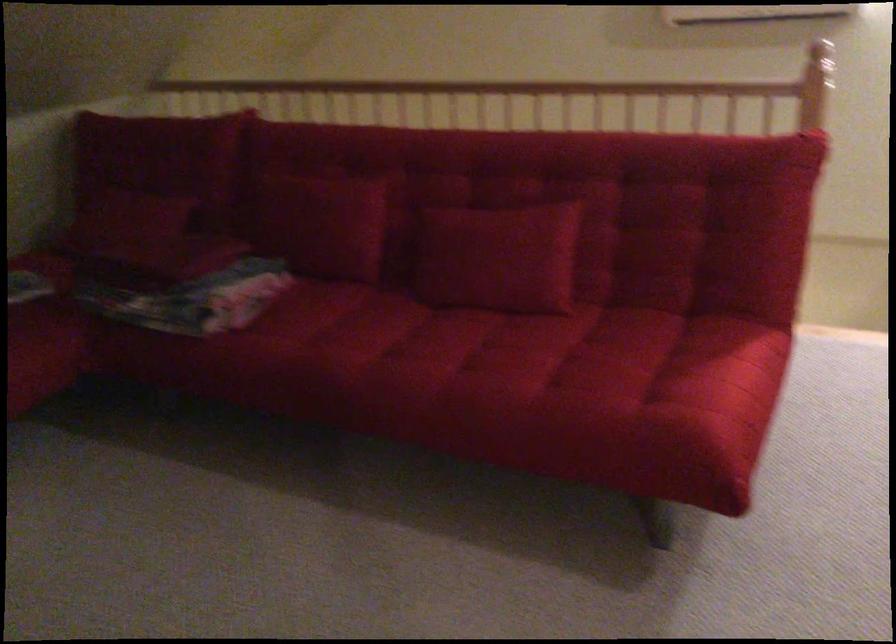
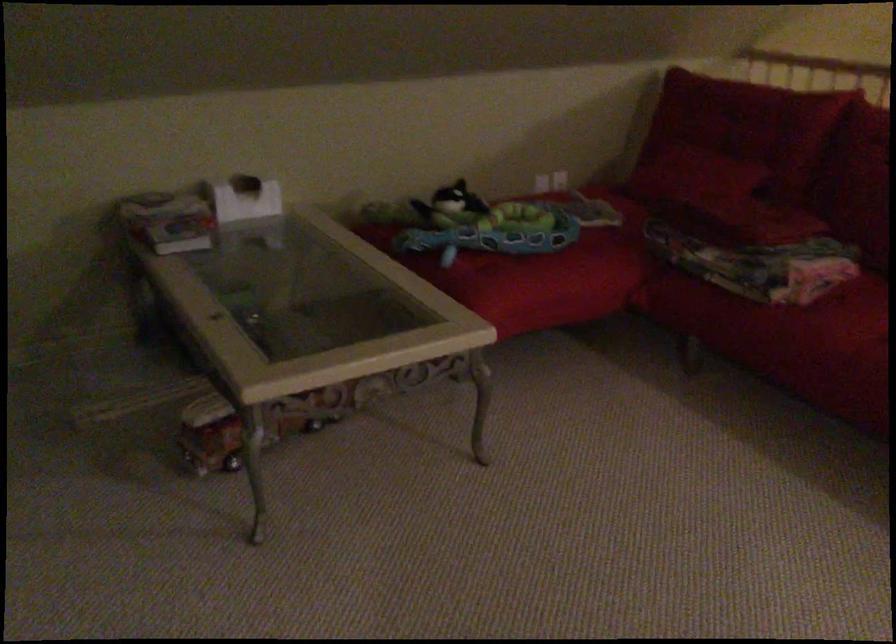
In the second image, find the point that corresponds to pixel 165 176 in the first image.

(745, 125)